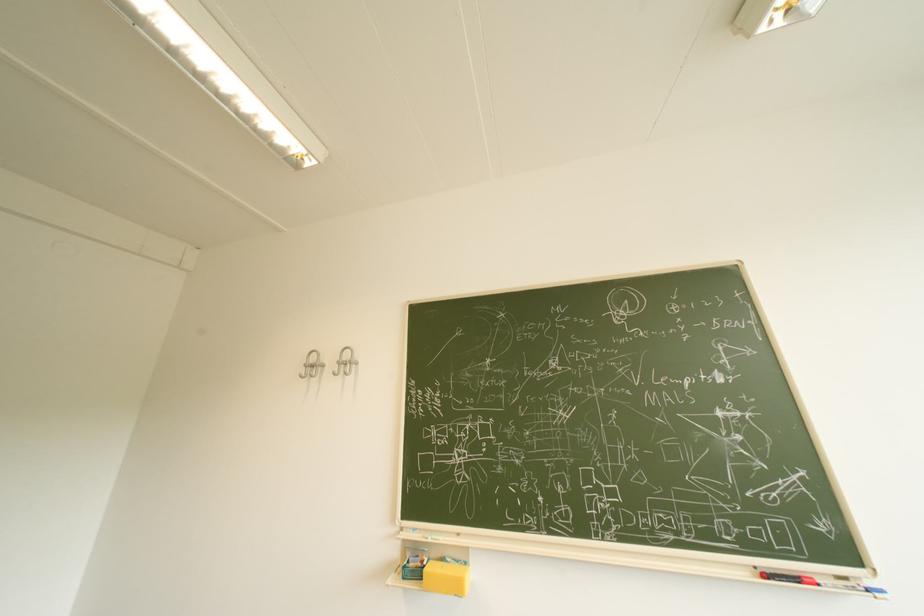
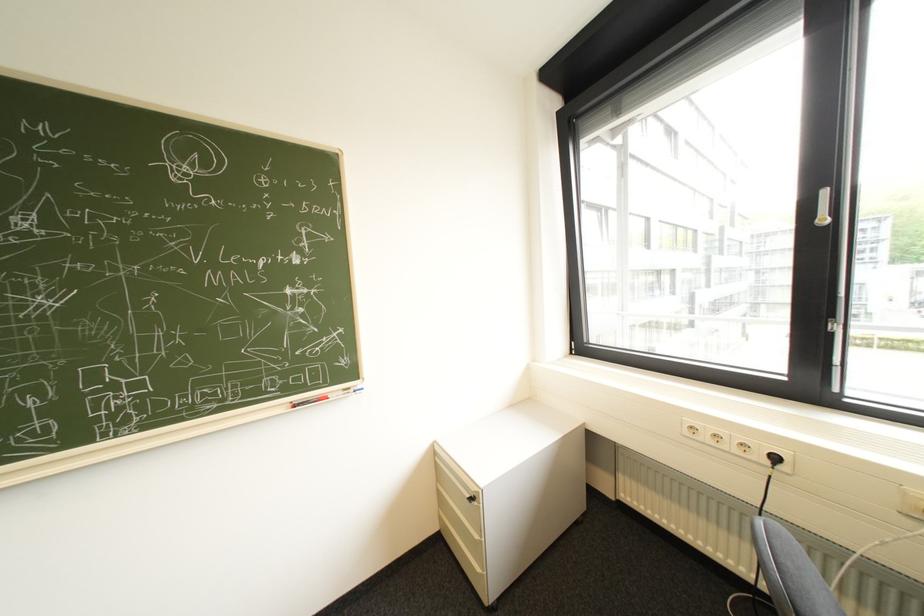
How did the camera likely rotate?

The camera rotated toward right-down.